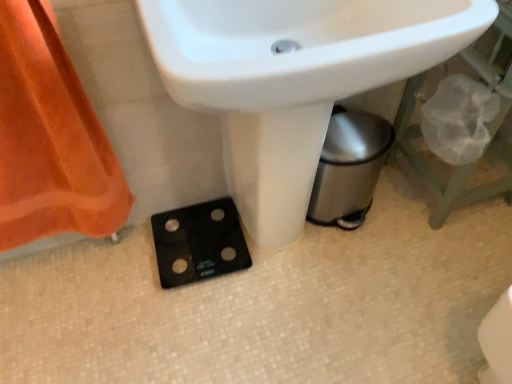
Identify the location of vacant space underneath orange fabric at left (from a real-world perspective). (81, 260).